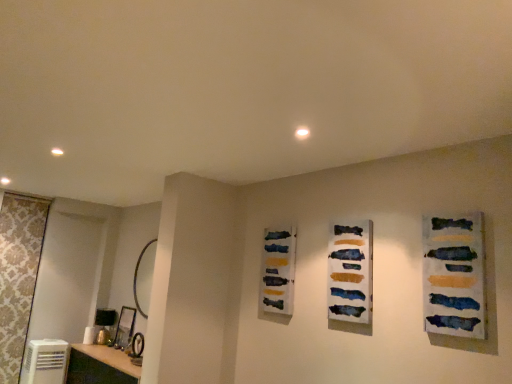
Question: Does point (426, 274) appear closer or farther from the camera than point (42, 365)?

Choices:
 (A) closer
 (B) farther

Answer: (A)

Question: Is textured canvas painting at right, which is the 1th art in right-to-left order, inside the boundaries of white plastic air conditioner at lower left, or outside?

Choices:
 (A) inside
 (B) outside

Answer: (B)

Question: Which is nearer to the textured canvas painting at right, which ranks as the third art in left-to-right order?

Choices:
 (A) white plastic air conditioner at lower left
 (B) gold metallic mirror at left
 (C) watercolor paint palette at center, the 1th art when ordered from left to right
 (D) white glossy vanity at lower left
 (E) watercolor paint strips at center, positioned as the second art in back-to-front order

Answer: (E)

Question: Estimate the real-world distances between objects in this image. Which object is farther from the white plastic air conditioner at lower left?

Choices:
 (A) textured canvas painting at right, which ranks as the third art in left-to-right order
 (B) white glossy vanity at lower left
 (C) watercolor paint palette at center, marked as the 3th art in a front-to-back arrangement
 (D) gold metallic mirror at left
 (E) watercolor paint strips at center, the 2th art from the left

Answer: (A)